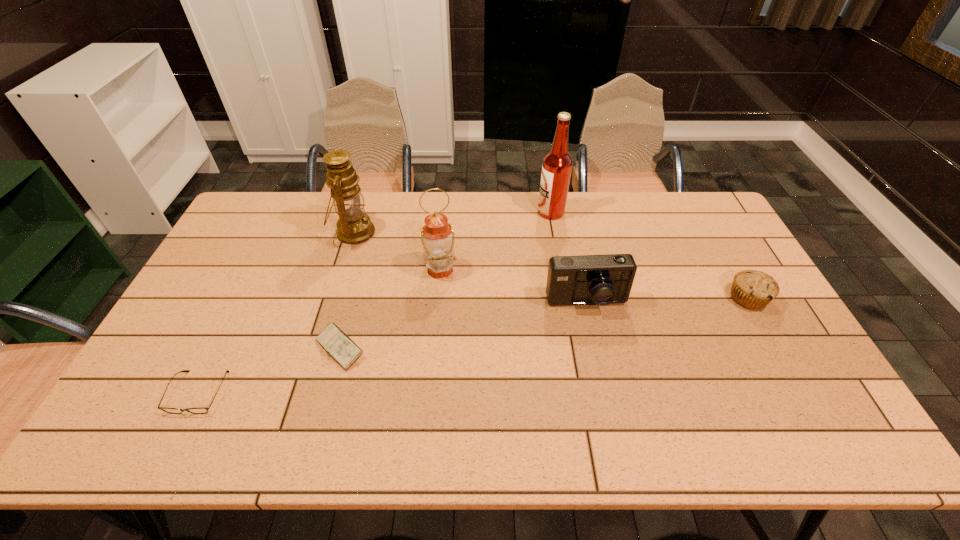
Identify the location of object present at the near edge. (202, 410).

This screenshot has width=960, height=540. I want to click on object that is at the left edge, so click(202, 410).

Find the location of a particular element. object situated at the right edge is located at coordinates (752, 289).

This screenshot has height=540, width=960. I want to click on object that is at the near left corner, so click(x=202, y=410).

You are a GUI agent. You are given a task and a screenshot of the screen. Output one action in this format:
    pyautogui.click(x=<x>, y=<y>)
    Task: Click on the vacant space at the far edge of the desktop
    The width and height of the screenshot is (960, 540).
    Given the screenshot: What is the action you would take?
    pyautogui.click(x=623, y=210)

The image size is (960, 540). Identify the location of free space at the left edge of the desktop. (169, 350).

You are a GUI agent. You are given a task and a screenshot of the screen. Output one action in this format:
    pyautogui.click(x=<x>, y=<y>)
    Task: Click on the vacant space at the right edge
    The image size is (960, 540).
    Given the screenshot: What is the action you would take?
    pyautogui.click(x=721, y=282)

Identify the location of vacant space at the far left corner of the desktop. (267, 204).

In the image, there is a desktop. Find the location of `free space at the far right corner`. free space at the far right corner is located at coordinates pyautogui.click(x=673, y=206).

Image resolution: width=960 pixels, height=540 pixels. In order to click on vacant region between the muffin and the shortest object in this screenshot , I will do click(473, 345).